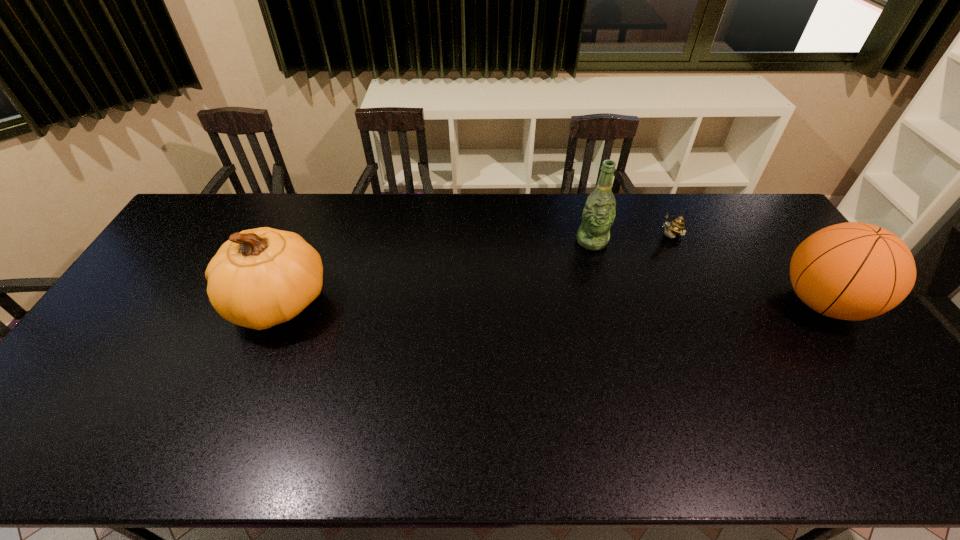
This screenshot has width=960, height=540. What are the coordinates of `the leftmost object` in the screenshot? It's located at (259, 278).

Where is `basketball`? basketball is located at coordinates (853, 271).

I want to click on beer bottle, so click(x=598, y=215).

At what (x,y) coordinates should I click in order to perform the action: click on the shortest object. Please return your answer as a coordinate pair (x, y). Image resolution: width=960 pixels, height=540 pixels. Looking at the image, I should click on (676, 227).

At what (x,y) coordinates should I click in order to perform the action: click on the third object from left to right. Please return your answer as a coordinate pair (x, y). The height and width of the screenshot is (540, 960). Looking at the image, I should click on (676, 227).

In order to click on free spot located on the front face of the pumpkin in this screenshot , I will do `click(204, 303)`.

The image size is (960, 540). In order to click on vacant point located 0.310m on the front face of the pumpkin in this screenshot , I will do `click(124, 303)`.

The height and width of the screenshot is (540, 960). What are the coordinates of `free spot located on the front face of the pumpkin` in the screenshot? It's located at (181, 303).

Locate an element on the screen. vacant position located on the back of the basketball is located at coordinates (752, 203).

You are a GUI agent. You are given a task and a screenshot of the screen. Output one action in this format:
    pyautogui.click(x=<x>, y=<y>)
    Task: Click on the free space located on the surface of the third object from right to left
    The image size is (960, 540).
    Given the screenshot: What is the action you would take?
    pyautogui.click(x=604, y=282)